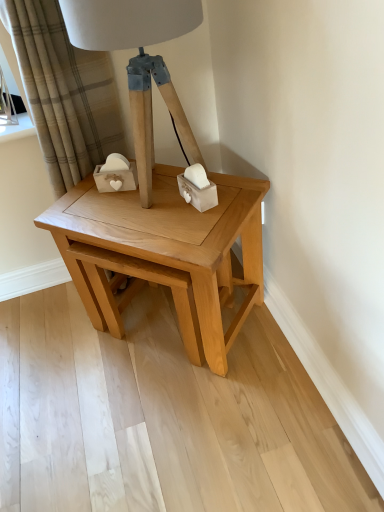
Find the location of a particular element. This screenshot has height=512, width=384. free space in front of natural wood table at center is located at coordinates (187, 429).